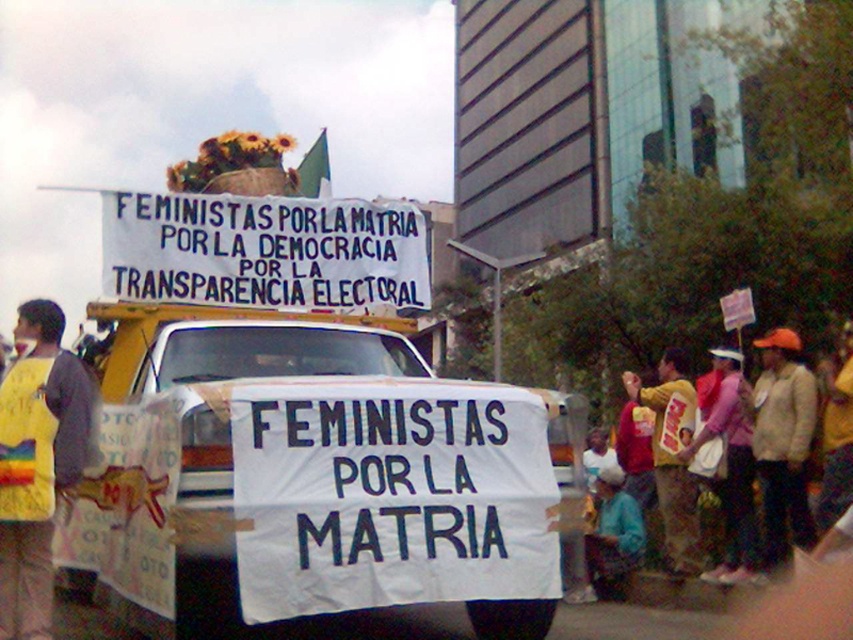
You are a photographer trying to capture the protest scene. You want to ensure the white paper banner at center and the blue fabric at lower center are both visible in your shot. Based on their positions, which object should you focus on first to include both in the frame?

The white paper banner at center is located above the blue fabric at lower center, so you should focus on the white paper banner at center first to ensure both are in the frame.

You are a photographer standing at the center of the street, aiming to capture the entire scene including the orange fabric jacket at right. What is the minimum horizontal distance you need to move to the left to ensure the jacket is fully visible in your frame?

The orange fabric jacket at right is positioned at point 0.689 on the horizontal axis. To ensure it is fully visible, you need to move to the left until your frame extends at least to the jacket, so moving left by approximately 0.689 units would place the jacket at the edge of the frame. However, to have it fully visible, you might need to move slightly further left, but the minimum distance is 0.689 units.

You are a photographer trying to capture a closeup of the yellow fabric vest at left and the pink fabric bag at lower right. Which object should you focus on first if you want to prioritize the taller one?

The yellow fabric vest at left is taller than the pink fabric vest at lower right, so you should focus on the yellow fabric vest at left first.